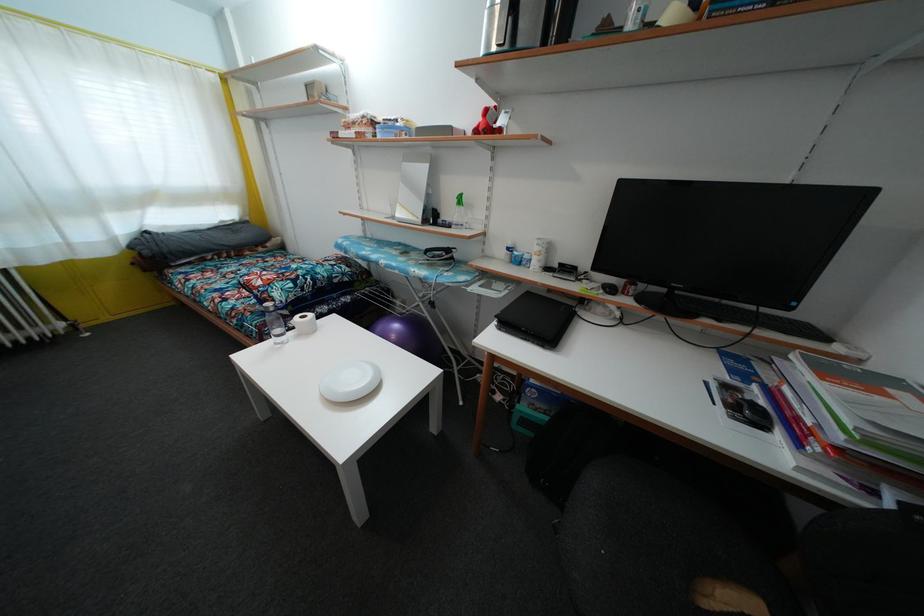
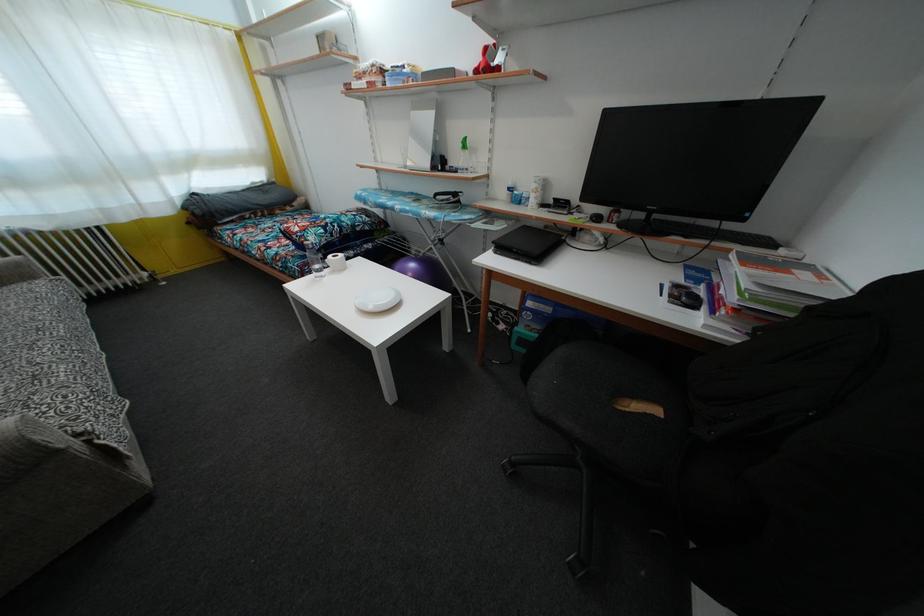
The point at (359,387) is marked in the first image. Where is the corresponding point in the second image?

(385, 306)